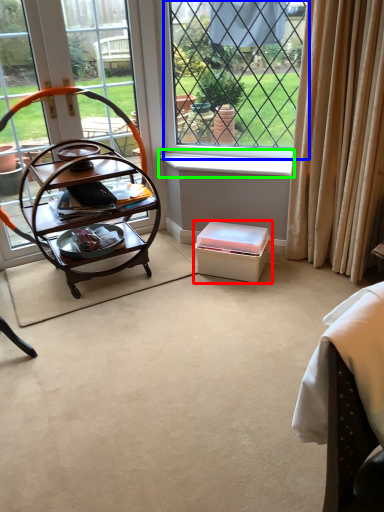
Question: Estimate the real-world distances between objects in this image. Which object is closer to box (highlighted by a red box), window (highlighted by a blue box) or window sill (highlighted by a green box)?

Choices:
 (A) window
 (B) window sill

Answer: (B)